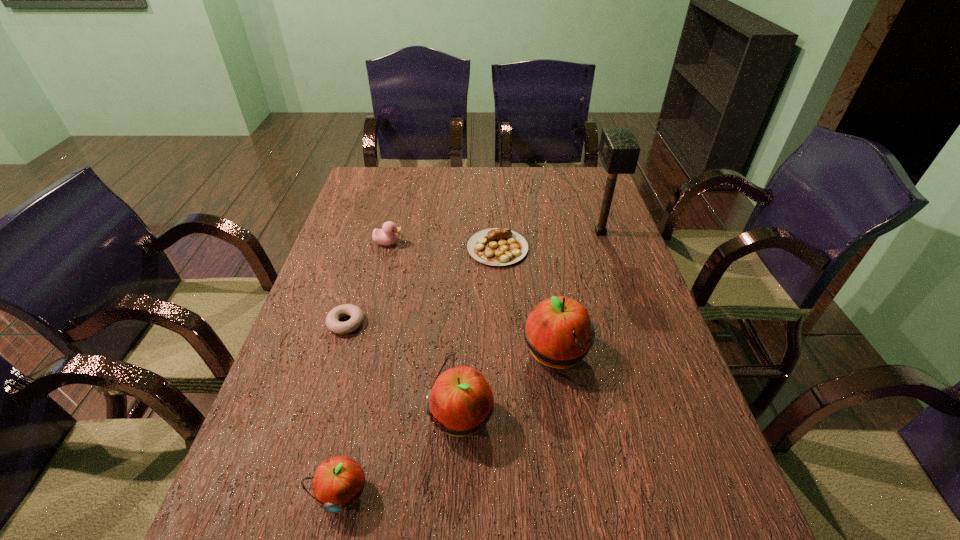
Observe the arrangement of all apples in the image. To keep them evenly spaced, where would you place another apple on the right? Please locate a free space. Please provide its 2D coordinates. Your answer should be formatted as a tuple, i.e. [(x, y)], where the tuple contains the x and y coordinates of a point satisfying the conditions above.

[(630, 307)]